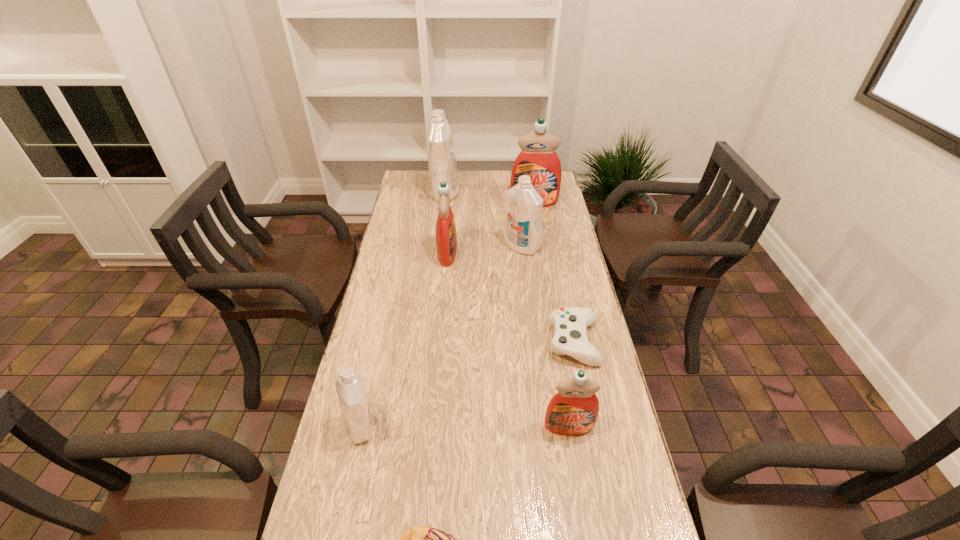
Find the location of a particular element. The height and width of the screenshot is (540, 960). empty space that is in between the shortest object and the biggest white detergent is located at coordinates (510, 268).

Point out which object is positioned as the nearest to the second smallest red detergent. Please provide its 2D coordinates. Your answer should be formatted as a tuple, i.e. [(x, y)], where the tuple contains the x and y coordinates of a point satisfying the conditions above.

[(523, 228)]

Identify which object is the nearest to the farthest white detergent. Please provide its 2D coordinates. Your answer should be formatted as a tuple, i.e. [(x, y)], where the tuple contains the x and y coordinates of a point satisfying the conditions above.

[(538, 159)]

Identify the location of detergent that is the third closest to the fifth farthest object. This screenshot has width=960, height=540. (446, 237).

Select which detergent is the second closest to the second farthest red detergent. Please provide its 2D coordinates. Your answer should be formatted as a tuple, i.e. [(x, y)], where the tuple contains the x and y coordinates of a point satisfying the conditions above.

[(441, 149)]

Where is `white detergent identified as the second closest to the second shortest object`? The width and height of the screenshot is (960, 540). white detergent identified as the second closest to the second shortest object is located at coordinates (523, 228).

This screenshot has height=540, width=960. I want to click on the third closest white detergent to the farthest red detergent, so click(353, 401).

Identify the location of red detergent object that ranks as the second closest to the second smallest white detergent. This screenshot has width=960, height=540. (538, 159).

Identify the location of red detergent that is the second closest to the second nearest red detergent. This screenshot has width=960, height=540. (574, 409).

Find the location of a particular element. This screenshot has width=960, height=540. blank space that satisfies the following two spatial constraints: 1. on the front side of the second nearest white detergent; 2. on the left side of the control is located at coordinates (533, 342).